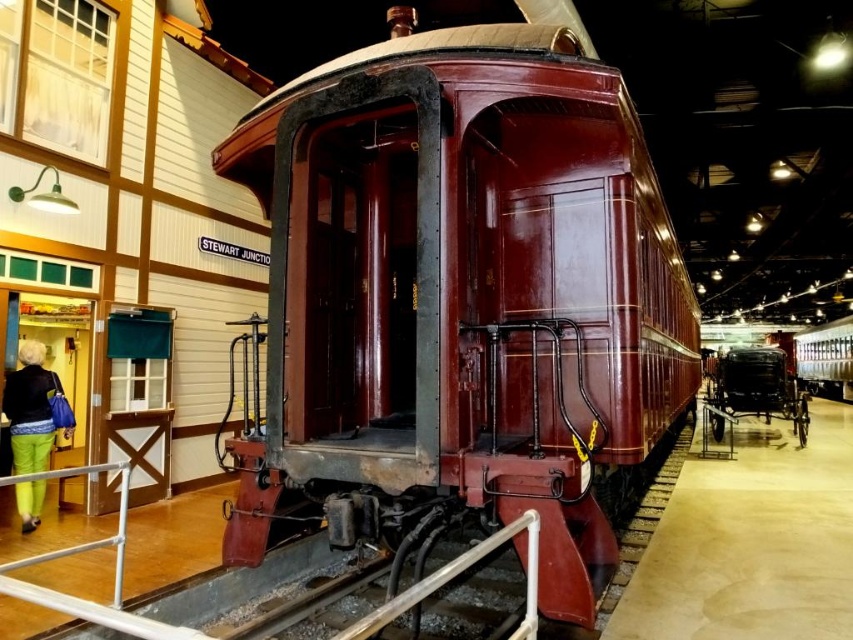
Question: Does green fabric pants at lower left appear on the left side of white metal rail at lower left?

Choices:
 (A) no
 (B) yes

Answer: (B)

Question: Does shiny dark red train at center have a smaller size compared to shiny silver train at right?

Choices:
 (A) yes
 (B) no

Answer: (A)

Question: Does white metal rail at lower left have a lesser width compared to shiny silver train at right?

Choices:
 (A) yes
 (B) no

Answer: (A)

Question: Which of the following is the farthest from the observer?

Choices:
 (A) (476, 445)
 (B) (775, 380)
 (C) (18, 452)
 (D) (3, 586)

Answer: (B)

Question: Among these points, which one is nearest to the camera?

Choices:
 (A) (817, 385)
 (B) (781, 372)

Answer: (B)

Question: Which object appears closest to the camera in this image?

Choices:
 (A) green fabric pants at lower left
 (B) shiny silver train at right
 (C) shiny black carriage at center

Answer: (A)